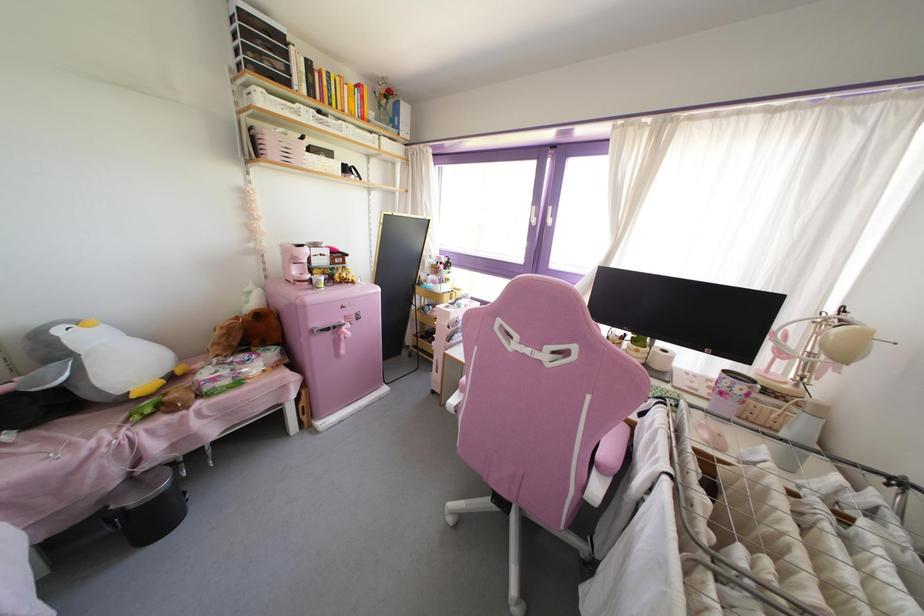
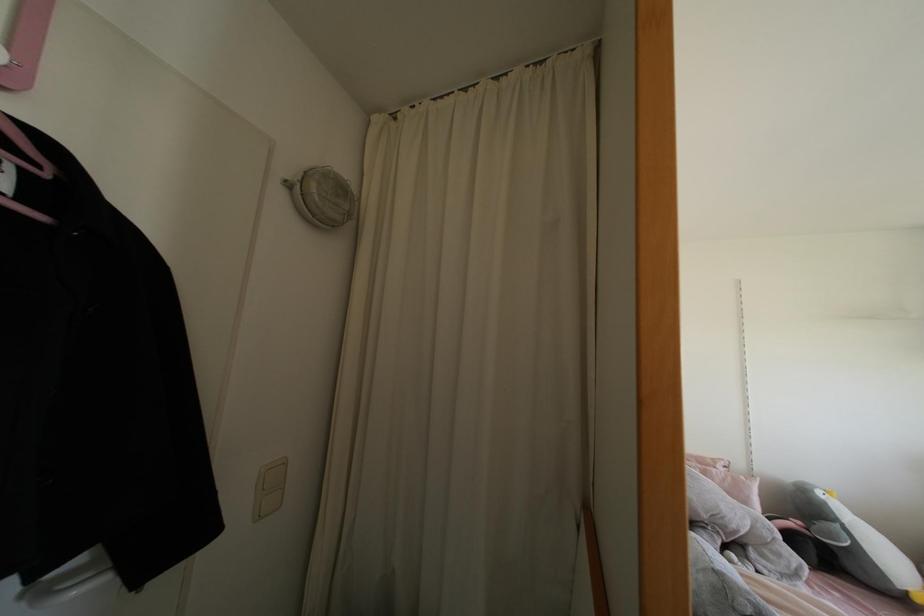
In the second image, find the point that corresponds to (56,330) in the first image.

(819, 493)